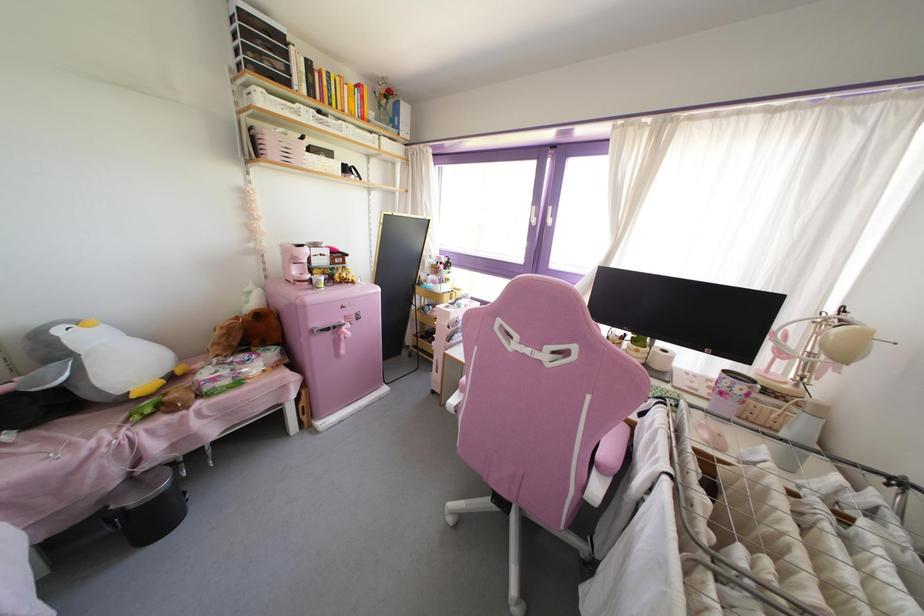
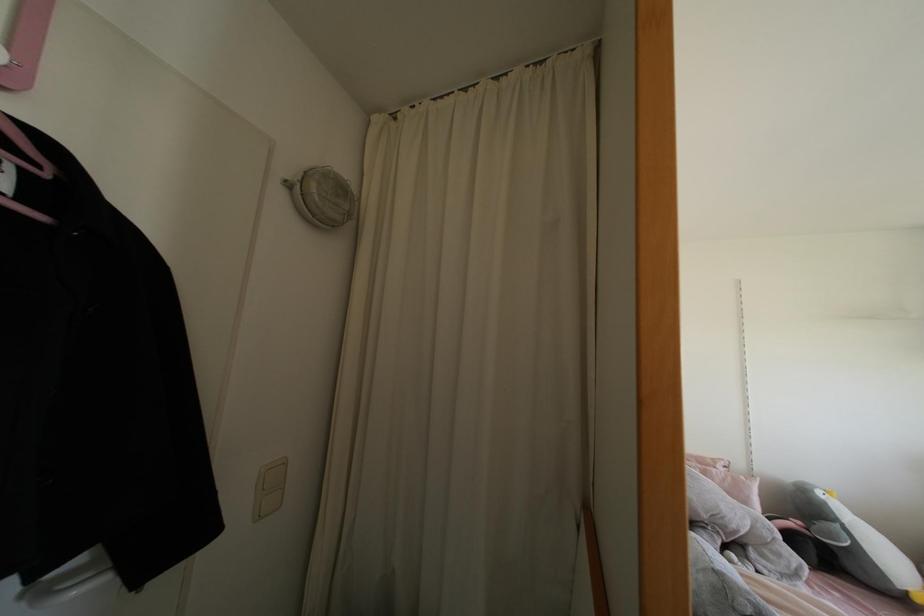
In the second image, find the point that corresponds to (56,330) in the first image.

(819, 493)